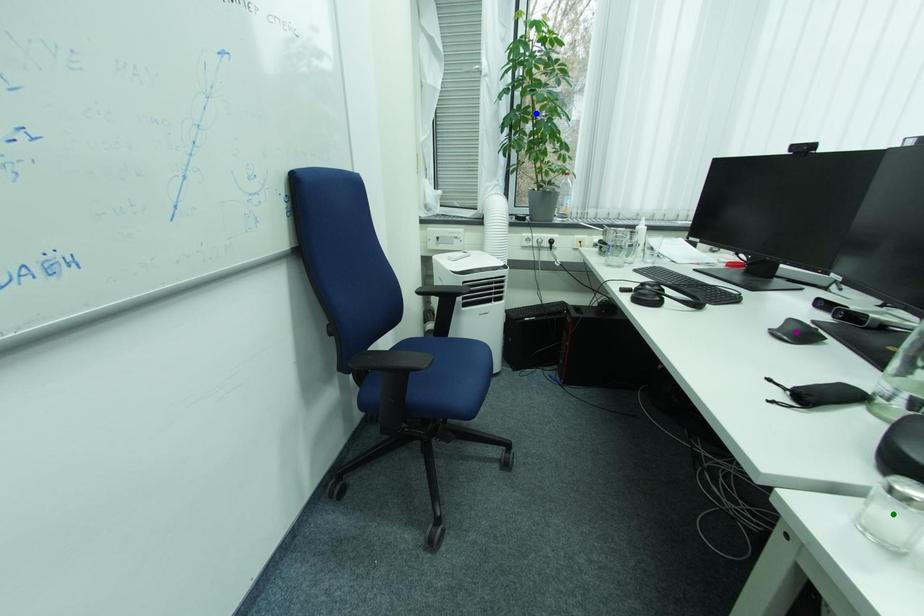
Order these from farthest to nearest:
blue point | green point | purple point

blue point < purple point < green point